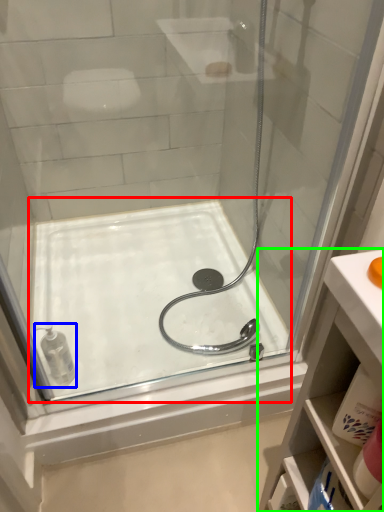
Question: Which object is the closest to the bath (highlighted by a red box)? Choose among these: toiletry (highlighted by a blue box) or bathroom cabinet (highlighted by a green box).

Choices:
 (A) toiletry
 (B) bathroom cabinet

Answer: (A)